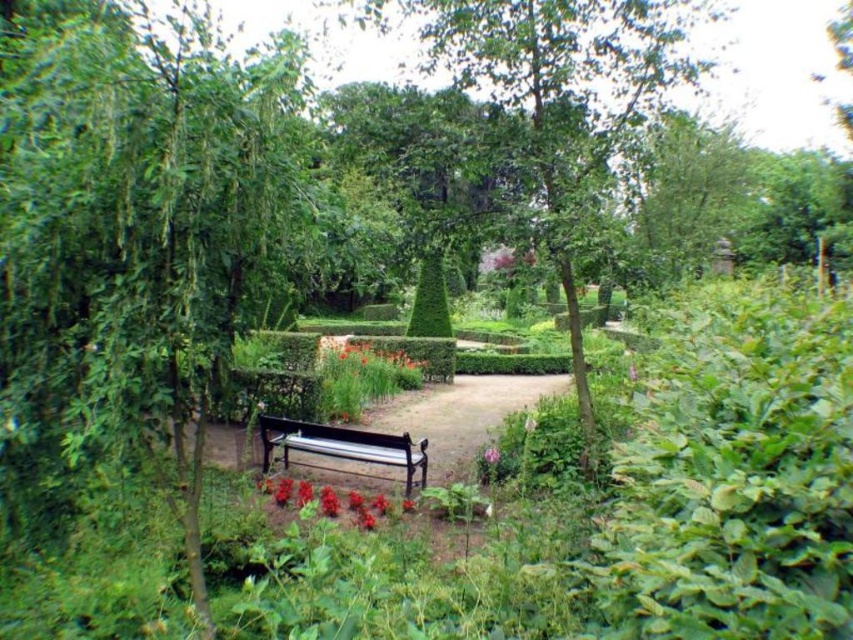
Question: Is green leafy tree at center positioned behind glossy red flowers at lower center?

Choices:
 (A) yes
 (B) no

Answer: (B)

Question: Can you confirm if green leafy tree at left is positioned below glossy red flowers at lower center?

Choices:
 (A) no
 (B) yes

Answer: (A)

Question: From the image, what is the correct spatial relationship of glossy red flowers at lower center in relation to pink matte flower at center?

Choices:
 (A) below
 (B) above

Answer: (A)

Question: Among these objects, which one is farthest from the camera?

Choices:
 (A) green leafy tree at center
 (B) black polished wood bench at center
 (C) green leafy tree at left

Answer: (B)

Question: Which point is farther to the camera?

Choices:
 (A) (323, 454)
 (B) (572, 296)

Answer: (B)

Question: Among these objects, which one is farthest from the camera?

Choices:
 (A) black polished wood bench at center
 (B) green leafy tree at center

Answer: (A)